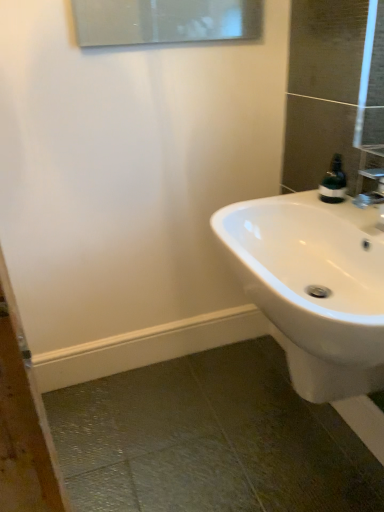
Question: From the image's perspective, is green matte soap dispenser at upper right below white glossy sink at lower right?

Choices:
 (A) no
 (B) yes

Answer: (A)

Question: Could you tell me if green matte soap dispenser at upper right is turned towards white glossy sink at lower right?

Choices:
 (A) no
 (B) yes

Answer: (A)

Question: Considering the relative sizes of green matte soap dispenser at upper right and white glossy sink at lower right in the image provided, is green matte soap dispenser at upper right taller than white glossy sink at lower right?

Choices:
 (A) no
 (B) yes

Answer: (A)

Question: Can you confirm if green matte soap dispenser at upper right is thinner than white glossy sink at lower right?

Choices:
 (A) no
 (B) yes

Answer: (B)

Question: Is the position of green matte soap dispenser at upper right less distant than that of white glossy sink at lower right?

Choices:
 (A) yes
 (B) no

Answer: (B)

Question: From the image's perspective, is green matte soap dispenser at upper right on white glossy sink at lower right?

Choices:
 (A) no
 (B) yes

Answer: (B)

Question: Can you confirm if white glossy sink at lower right is bigger than green matte soap dispenser at upper right?

Choices:
 (A) yes
 (B) no

Answer: (A)

Question: From the image's perspective, is white glossy sink at lower right located above green matte soap dispenser at upper right?

Choices:
 (A) no
 (B) yes

Answer: (A)

Question: Could you tell me if white glossy sink at lower right is facing green matte soap dispenser at upper right?

Choices:
 (A) yes
 (B) no

Answer: (B)

Question: Is the depth of white glossy sink at lower right less than that of green matte soap dispenser at upper right?

Choices:
 (A) yes
 (B) no

Answer: (A)

Question: Is white glossy sink at lower right not near green matte soap dispenser at upper right?

Choices:
 (A) no
 (B) yes

Answer: (A)

Question: From a real-world perspective, is white glossy sink at lower right positioned over green matte soap dispenser at upper right based on gravity?

Choices:
 (A) no
 (B) yes

Answer: (A)

Question: Is white glossy sink at lower right in front of or behind green matte soap dispenser at upper right in the image?

Choices:
 (A) front
 (B) behind

Answer: (A)